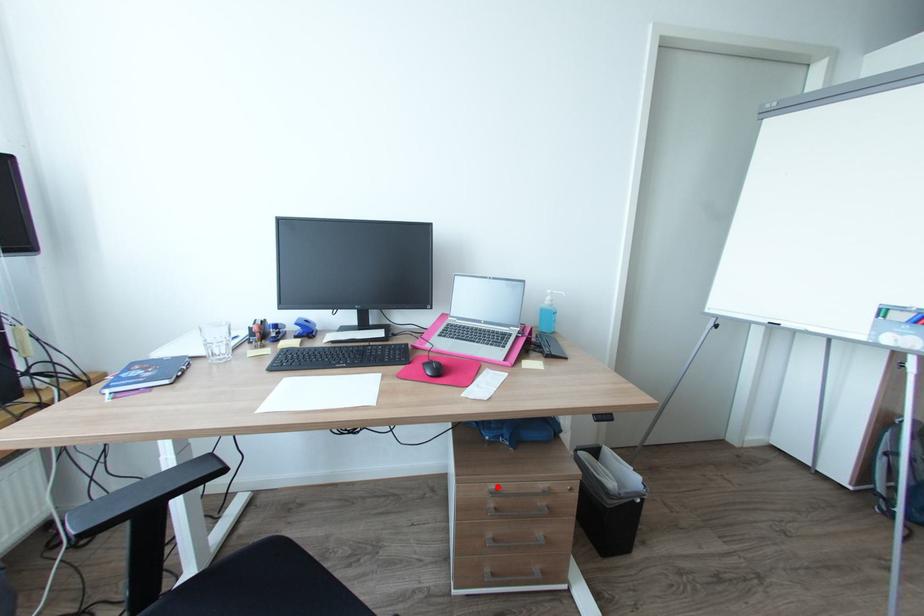
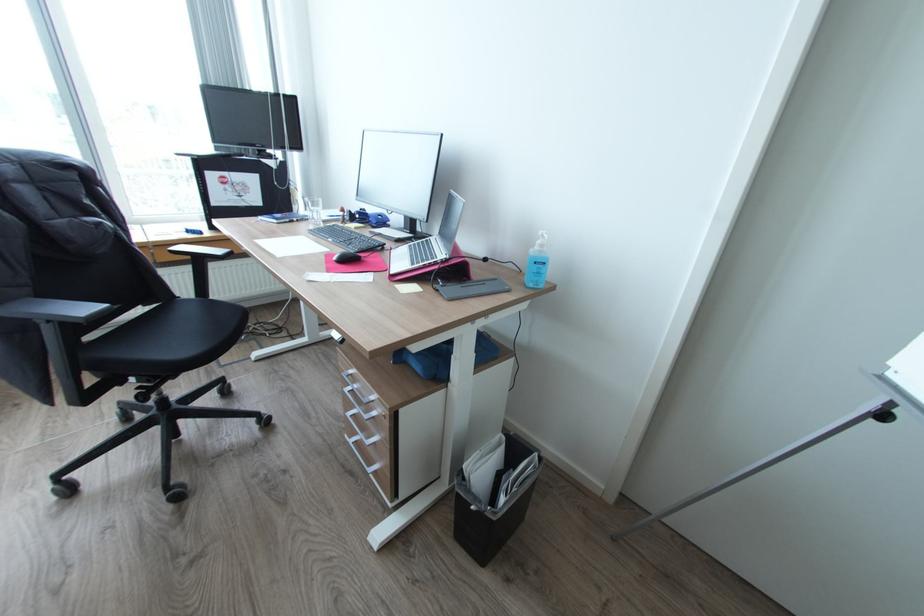
Question: I am providing you with two images of the same scene from different viewpoints. In image1, a red point is highlighted. Considering the same 3D point in image2, which of the following is correct?

Choices:
 (A) It is closer
 (B) It is farther

Answer: (B)